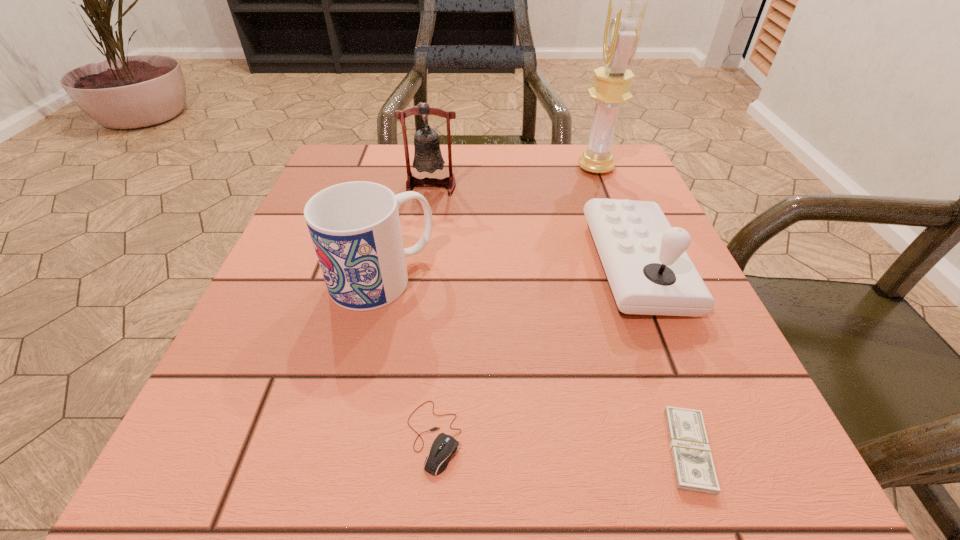
Where is `joystick that is at the right edge`? The image size is (960, 540). joystick that is at the right edge is located at coordinates (649, 272).

Locate an element on the screen. The image size is (960, 540). money situated at the right edge is located at coordinates (694, 470).

You are a GUI agent. You are given a task and a screenshot of the screen. Output one action in this format:
    pyautogui.click(x=<x>, y=<y>)
    Task: Click on the object situated at the far right corner
    Image resolution: width=960 pixels, height=540 pixels.
    Given the screenshot: What is the action you would take?
    pyautogui.click(x=625, y=17)

Where is `object that is positioned at the near right corner`? The width and height of the screenshot is (960, 540). object that is positioned at the near right corner is located at coordinates (694, 470).

Find the location of a particular element. Image resolution: width=960 pixels, height=540 pixels. vacant position at the far edge of the desktop is located at coordinates (441, 145).

Locate an element on the screen. blank area at the near edge is located at coordinates (599, 449).

Find the location of `vacant space at the left edge`. vacant space at the left edge is located at coordinates (271, 275).

In the image, there is a desktop. At what (x,y) coordinates should I click in order to perform the action: click on vacant space at the right edge. Please return your answer as a coordinate pair (x, y). Looking at the image, I should click on (581, 206).

Find the location of a particular element. This screenshot has height=540, width=960. vacant point at the far left corner is located at coordinates (339, 144).

In the image, there is a desktop. Where is `vacant region at the far right corner`? This screenshot has height=540, width=960. vacant region at the far right corner is located at coordinates pyautogui.click(x=569, y=159).